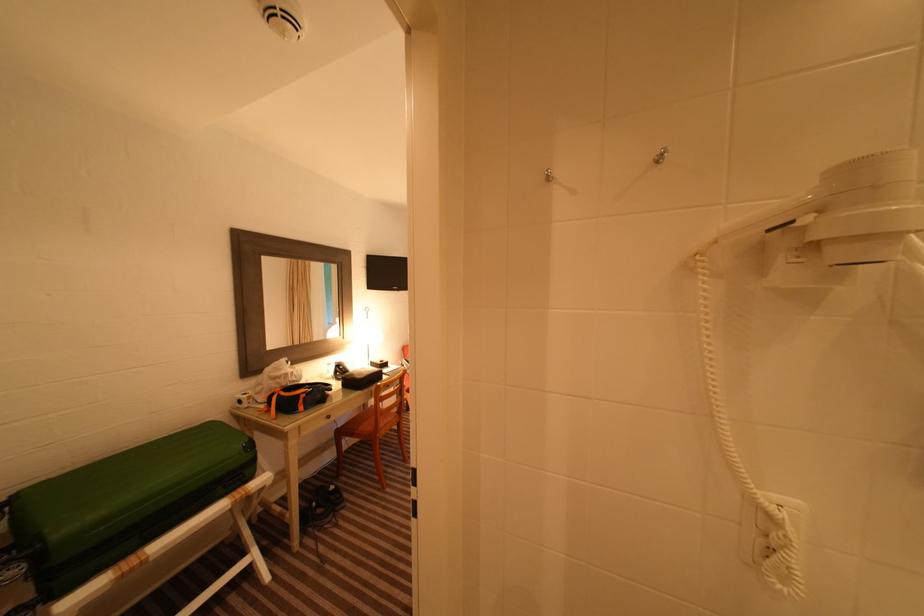
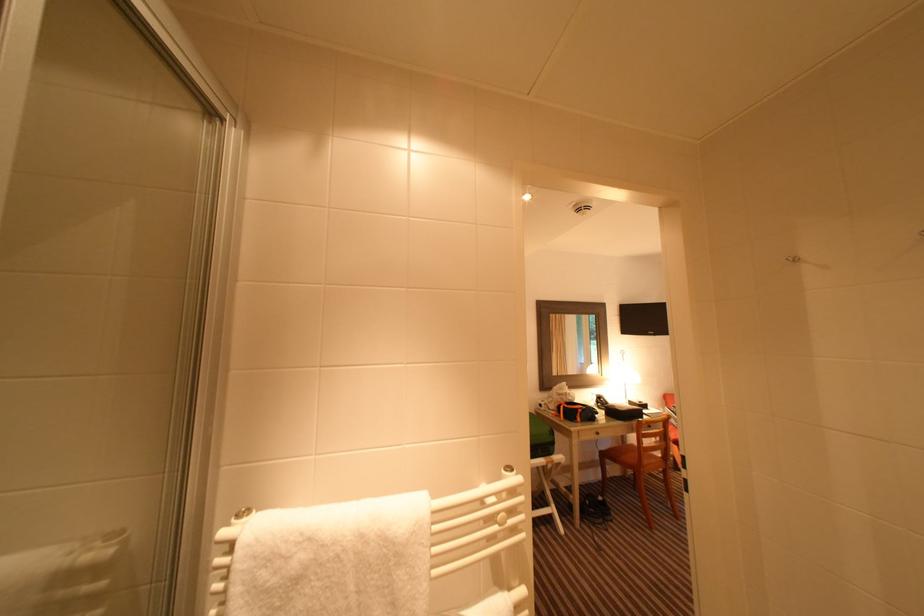
Question: The first image is from the beginning of the video and the second image is from the end. How did the camera likely rotate when shooting the video?

Choices:
 (A) Left
 (B) Right
 (C) Up
 (D) Down

Answer: (A)